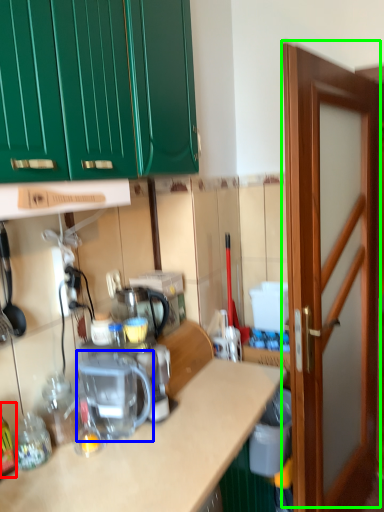
Question: Which object is positioned farthest from bottle (highlighted by a red box)? Select from coffee machine (highlighted by a blue box) and door (highlighted by a green box).

Choices:
 (A) coffee machine
 (B) door

Answer: (B)